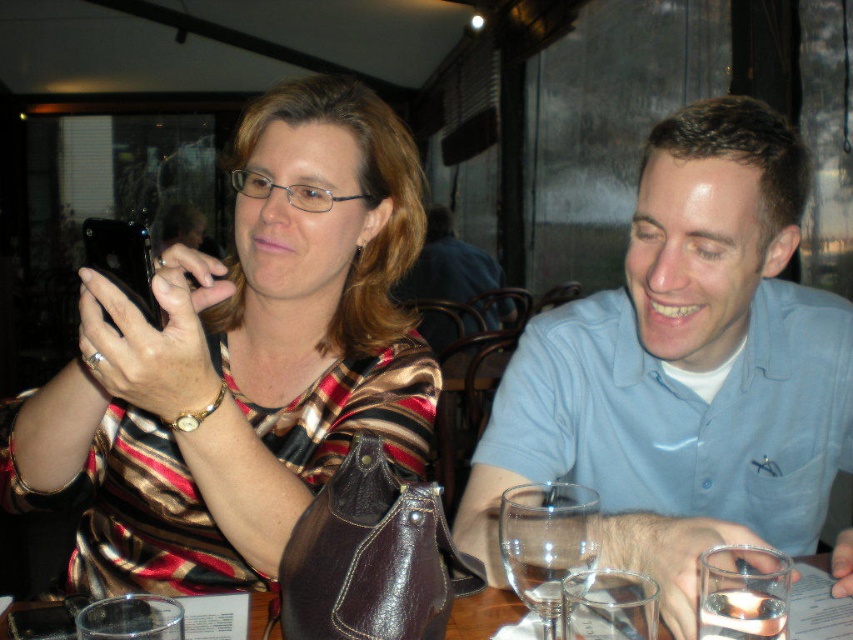
Question: Is blue cotton shirt at center bigger than transparent glass at lower center?

Choices:
 (A) no
 (B) yes

Answer: (B)

Question: Based on their relative distances, which object is nearer to the transparent glass at lower center?

Choices:
 (A) transparent glassware at center
 (B) blue cotton shirt at center
 (C) shiny brown purse at center

Answer: (A)

Question: Which point appears closest to the camera in this image?

Choices:
 (A) (35, 602)
 (B) (688, 221)
 (C) (550, 500)
 (D) (286, 180)

Answer: (C)

Question: Among these objects, which one is farthest from the camera?

Choices:
 (A) blue cotton shirt at center
 (B) transparent glass at lower center
 (C) shiny brown purse at center
 (D) transparent glassware at center

Answer: (D)

Question: From the image, what is the correct spatial relationship of blue cotton shirt at center in relation to transparent glassware at center?

Choices:
 (A) above
 (B) below

Answer: (A)

Question: Is shiny brown purse at center to the left of transparent glass at lower center from the viewer's perspective?

Choices:
 (A) no
 (B) yes

Answer: (B)